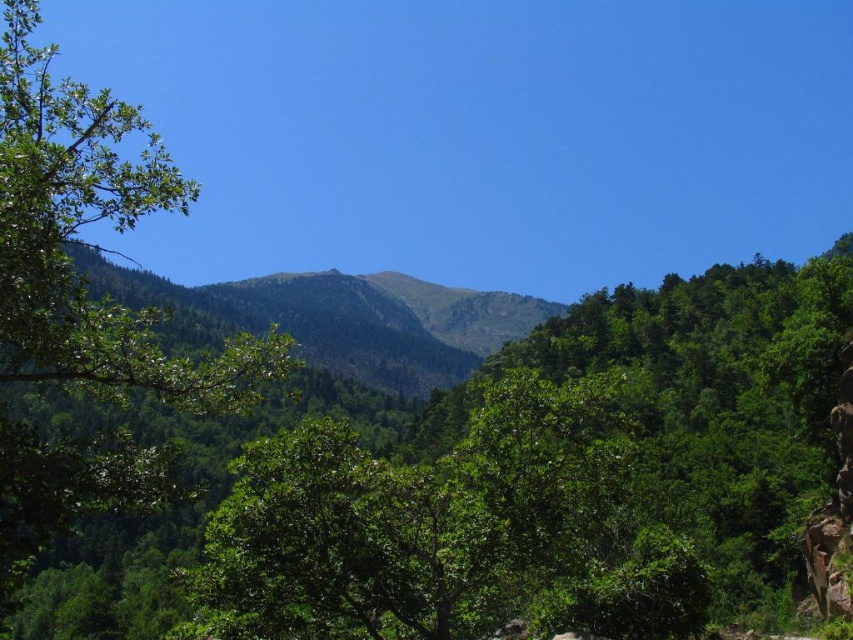
Looking at this image, you are an environmental scientist analyzing the landscape. You need to determine which tree has a larger canopy spread between the green leafy tree at center and the green leafy tree at left. Which one should you report?

The green leafy tree at center has a larger canopy spread since its width surpasses that of the green leafy tree at left.

You are standing at point [514,486] in the lush landscape. What can you see directly in front of you?

At point [514,486] lies green leafy tree at center.